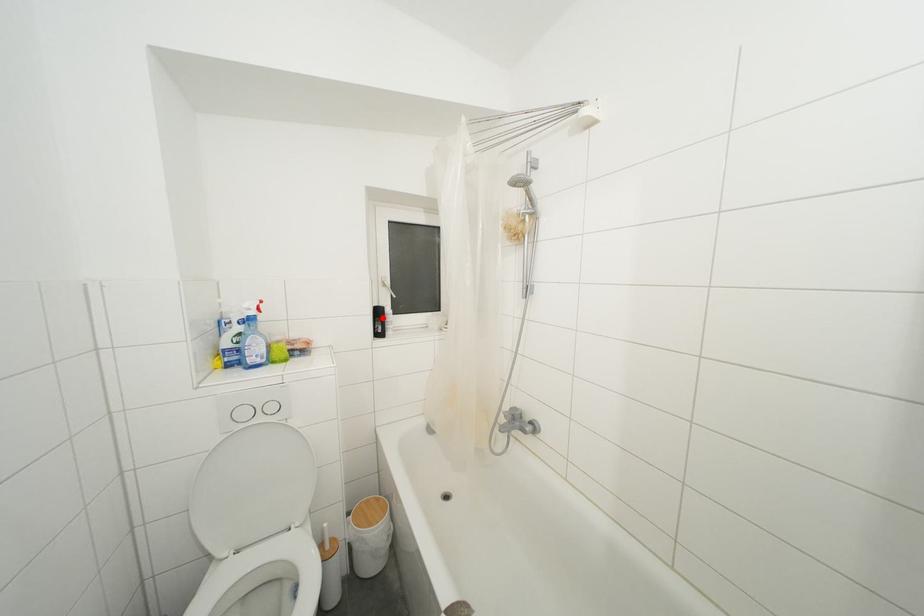
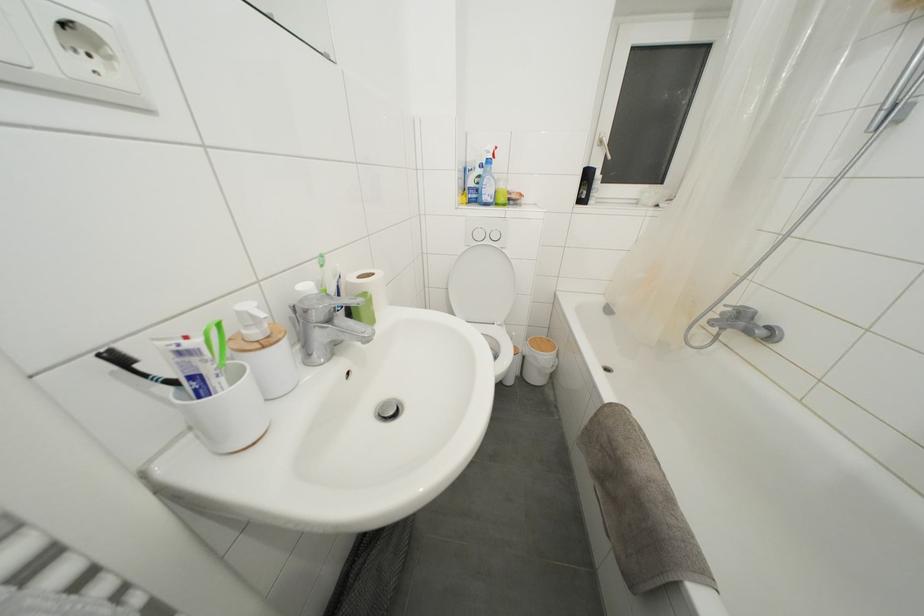
In the second image, find the point that corresponds to the highlighted location in the first image.

(591, 180)